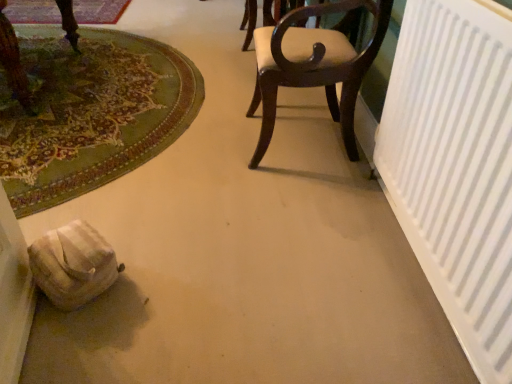
Question: Considering the relative positions of green carpet at lower left, which is the first mat in front-to-back order, and dark wood chair at center in the image provided, is green carpet at lower left, which is the first mat in front-to-back order, in front of dark wood chair at center?

Choices:
 (A) yes
 (B) no

Answer: (A)

Question: Could dark wood chair at center be considered to be inside green carpet at lower left, the second mat positioned from the back?

Choices:
 (A) no
 (B) yes

Answer: (A)

Question: Does green carpet at lower left, the second mat positioned from the back, turn towards dark wood chair at center?

Choices:
 (A) yes
 (B) no

Answer: (B)

Question: Is green carpet at lower left, which is the first mat in front-to-back order, oriented away from dark wood chair at center?

Choices:
 (A) yes
 (B) no

Answer: (B)

Question: From the image's perspective, is green carpet at lower left, which is the first mat in front-to-back order, under dark wood chair at center?

Choices:
 (A) yes
 (B) no

Answer: (B)

Question: Does green carpet at lower left, which is the first mat in front-to-back order, have a smaller size compared to dark wood chair at center?

Choices:
 (A) no
 (B) yes

Answer: (A)

Question: Is carpeted mat at upper left, the first mat when ordered from top to bottom, smaller than white matte radiator at right?

Choices:
 (A) no
 (B) yes

Answer: (B)

Question: Considering the relative sizes of carpeted mat at upper left, the second mat from the front, and white matte radiator at right in the image provided, is carpeted mat at upper left, the second mat from the front, wider than white matte radiator at right?

Choices:
 (A) yes
 (B) no

Answer: (A)

Question: Is carpeted mat at upper left, positioned as the 1th mat in back-to-front order, facing towards white matte radiator at right?

Choices:
 (A) yes
 (B) no

Answer: (B)

Question: From the image's perspective, does carpeted mat at upper left, the first mat when ordered from top to bottom, appear lower than white matte radiator at right?

Choices:
 (A) no
 (B) yes

Answer: (A)

Question: From a real-world perspective, is carpeted mat at upper left, which is the second mat in bottom-to-top order, located higher than white matte radiator at right?

Choices:
 (A) no
 (B) yes

Answer: (A)

Question: Is carpeted mat at upper left, the second mat from the front, far from white matte radiator at right?

Choices:
 (A) yes
 (B) no

Answer: (A)

Question: Is carpeted mat at upper left, the second mat from the front, looking in the opposite direction of dark wood chair at center?

Choices:
 (A) yes
 (B) no

Answer: (B)